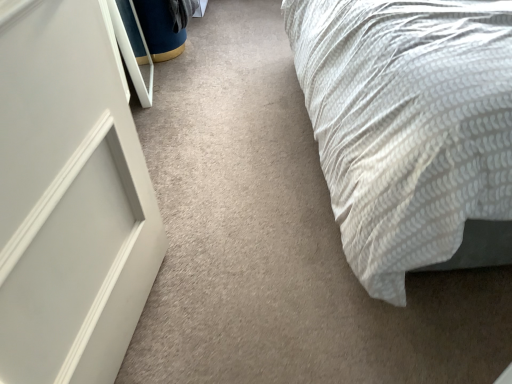
Question: Should I look upward or downward to see white textured bed at right?

Choices:
 (A) down
 (B) up

Answer: (B)